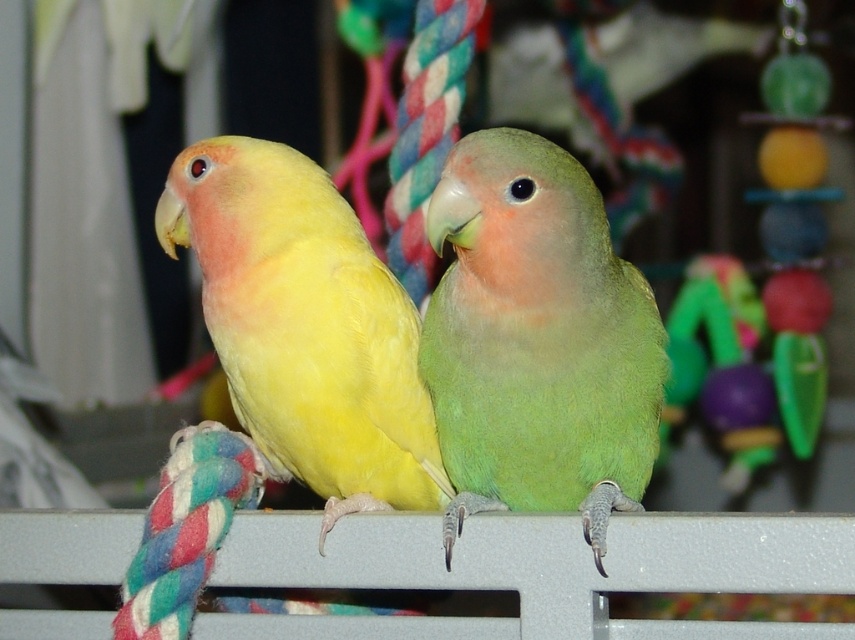
You are a bird enthusiast observing two parrots on a rope. The green matte parrot at center and the yellow matte parrot at left are both perched. Which parrot is smaller in size?

The green matte parrot at center is smaller in size compared to the yellow matte parrot at left according to the description.

You are a bird enthusiast observing the scene. You notice the green matte parrot at center. Can you determine its exact coordinates in the image?

The green matte parrot at center is located at coordinates point (x=537, y=340).

You are holding a small green ball that you want to throw to the point marked by the coordinates point (x=423, y=384). If you can throw the ball 1.5 meters, will it reach the point?

The distance between the point (x=423, y=384) and the viewer is 1.36 meters, so yes, the green ball can reach the point as the throwing distance is sufficient.